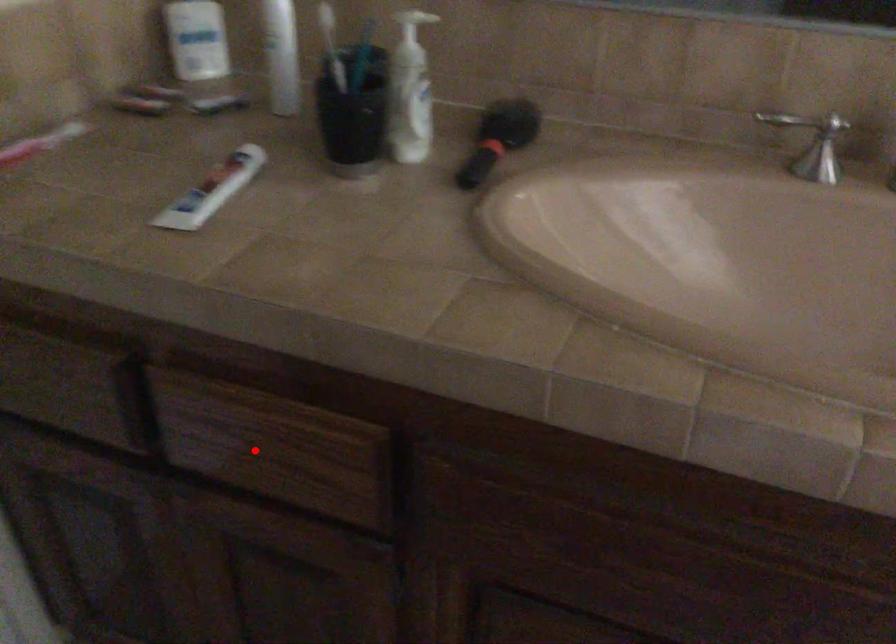
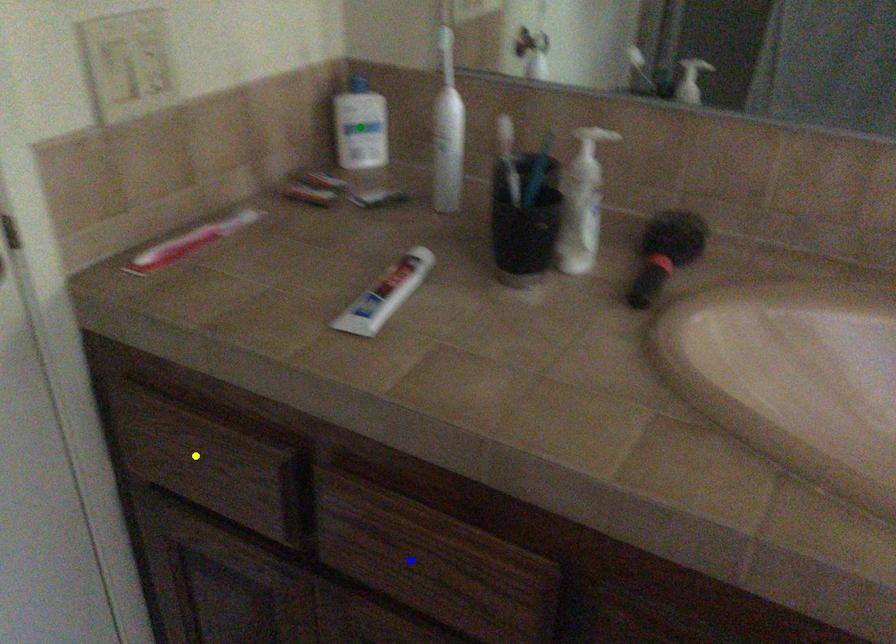
Question: I am providing you with two images of the same scene from different viewpoints. A red point is marked on the first image. You are given multiple points on the second image. Which mark in image 2 goes with the point in image 1?

Choices:
 (A) green point
 (B) blue point
 (C) yellow point

Answer: (B)